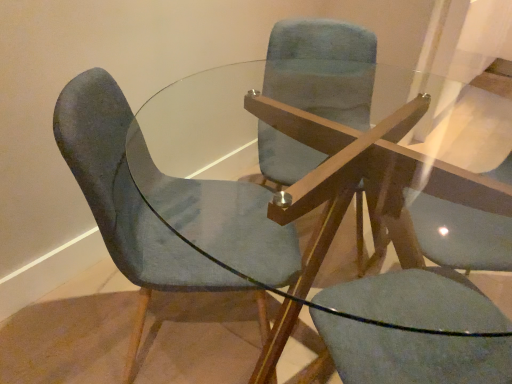
Question: Is point (367, 286) closer or farther from the camera than point (121, 142)?

Choices:
 (A) closer
 (B) farther

Answer: (A)

Question: Which is correct: matte blue swivel chair at center is inside velvet blue chair at left, arranged as the second chair when viewed from the left, or outside of it?

Choices:
 (A) inside
 (B) outside

Answer: (A)

Question: Which object is positioned closest to the matte blue swivel chair at center?

Choices:
 (A) velvet blue chair at left, arranged as the second chair when viewed from the left
 (B) velvet blue chair at center, acting as the 2th chair starting from the right

Answer: (A)

Question: Estimate the real-world distances between objects in this image. Which object is closer to the velvet blue chair at center, arranged as the 1th chair when viewed from the left?

Choices:
 (A) matte blue swivel chair at center
 (B) velvet blue chair at left, arranged as the second chair when viewed from the left

Answer: (B)